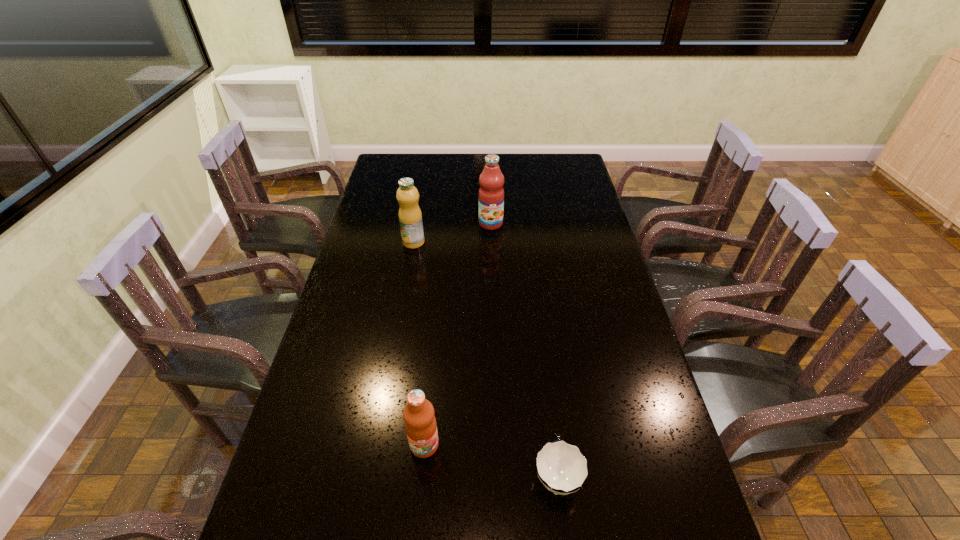
The height and width of the screenshot is (540, 960). Identify the location of free region located 0.090m on the front label of the second object from left to right. (419, 500).

Locate an element on the screen. vacant point located on the side of the rightmost object with the handle is located at coordinates (547, 406).

Locate an element on the screen. This screenshot has height=540, width=960. free location located on the side of the rightmost object with the handle is located at coordinates (537, 320).

This screenshot has height=540, width=960. In order to click on blank space located on the side of the rightmost object with the handle in this screenshot , I will do `click(539, 333)`.

In the image, there is a desktop. Identify the location of vacant area at the far edge. This screenshot has height=540, width=960. (469, 160).

Identify the location of blank space at the left edge of the desktop. This screenshot has height=540, width=960. (350, 428).

This screenshot has height=540, width=960. I want to click on vacant space at the right edge of the desktop, so click(582, 312).

This screenshot has width=960, height=540. Identify the location of free spot between the second shortest object and the leftmost object. (419, 343).

At what (x,y) coordinates should I click in order to perform the action: click on vacant space that is in between the second farthest object and the second object from left to right. Please return your answer as a coordinate pair (x, y). The width and height of the screenshot is (960, 540). Looking at the image, I should click on (x=419, y=343).

Identify the location of unoccupied position between the shortest fruit juice and the rightmost object. Image resolution: width=960 pixels, height=540 pixels. coord(491,461).